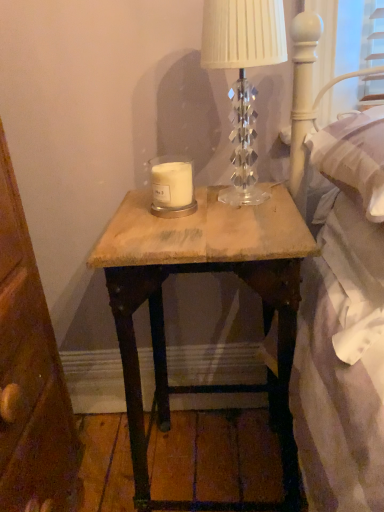
This screenshot has width=384, height=512. Identify the location of vacant space situated on the left part of white matte candle at center. (135, 208).